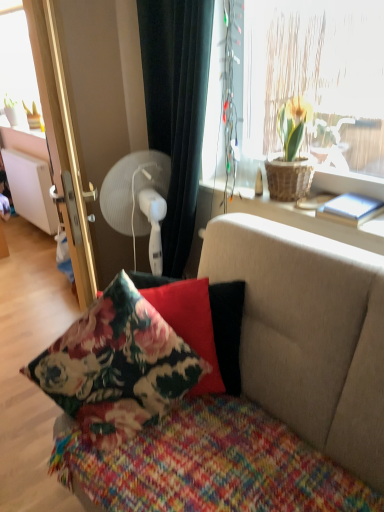
Question: Does floral fabric couch at center have a greater width compared to floral fabric pillow at center, the 1th pillow from the back?

Choices:
 (A) yes
 (B) no

Answer: (A)

Question: Is floral fabric pillow at center, placed as the second pillow when sorted from front to back, at the back of floral fabric couch at center?

Choices:
 (A) no
 (B) yes

Answer: (B)

Question: Can you confirm if floral fabric couch at center is positioned to the left of floral fabric pillow at center, placed as the second pillow when sorted from front to back?

Choices:
 (A) no
 (B) yes

Answer: (A)

Question: Is floral fabric couch at center facing towards floral fabric pillow at center, placed as the second pillow when sorted from front to back?

Choices:
 (A) no
 (B) yes

Answer: (A)

Question: Could floral fabric pillow at center, placed as the second pillow when sorted from front to back, be considered to be inside floral fabric couch at center?

Choices:
 (A) yes
 (B) no

Answer: (A)

Question: Is white plastic fan at upper left taller or shorter than floral fabric cushion at center, which is the first pillow from front to back?

Choices:
 (A) tall
 (B) short

Answer: (B)

Question: Considering their positions, is white plastic fan at upper left located in front of or behind floral fabric cushion at center, which is the first pillow from front to back?

Choices:
 (A) behind
 (B) front

Answer: (A)

Question: In terms of size, does white plastic fan at upper left appear bigger or smaller than floral fabric cushion at center, the 2th pillow when ordered from back to front?

Choices:
 (A) big
 (B) small

Answer: (B)

Question: Would you say white plastic fan at upper left is to the left or to the right of floral fabric cushion at center, the 2th pillow when ordered from back to front, in the picture?

Choices:
 (A) left
 (B) right

Answer: (B)

Question: Considering the relative positions of brown woven basket at upper right and black fabric curtain at upper center in the image provided, is brown woven basket at upper right to the left or to the right of black fabric curtain at upper center?

Choices:
 (A) right
 (B) left

Answer: (A)

Question: From a real-world perspective, relative to black fabric curtain at upper center, is brown woven basket at upper right vertically above or below?

Choices:
 (A) above
 (B) below

Answer: (B)

Question: From the image's perspective, is brown woven basket at upper right positioned above or below black fabric curtain at upper center?

Choices:
 (A) above
 (B) below

Answer: (B)

Question: From their relative heights in the image, would you say brown woven basket at upper right is taller or shorter than black fabric curtain at upper center?

Choices:
 (A) tall
 (B) short

Answer: (B)

Question: Is white plastic fan at upper left wider or thinner than floral fabric pillow at center, the 1th pillow from the back?

Choices:
 (A) thin
 (B) wide

Answer: (B)

Question: Looking at the image, does white plastic fan at upper left seem bigger or smaller compared to floral fabric pillow at center, the 1th pillow from the back?

Choices:
 (A) big
 (B) small

Answer: (B)